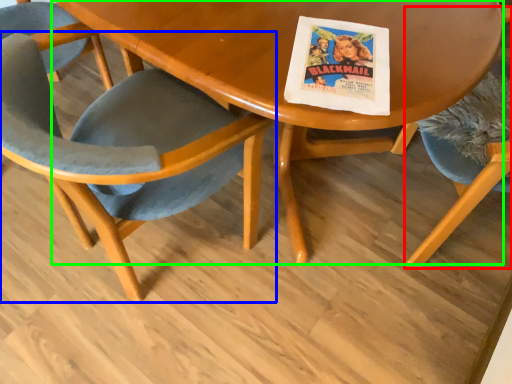
Question: Considering the real-world distances, which object is farthest from chair (highlighted by a red box)? chair (highlighted by a blue box) or table (highlighted by a green box)?

Choices:
 (A) chair
 (B) table

Answer: (A)